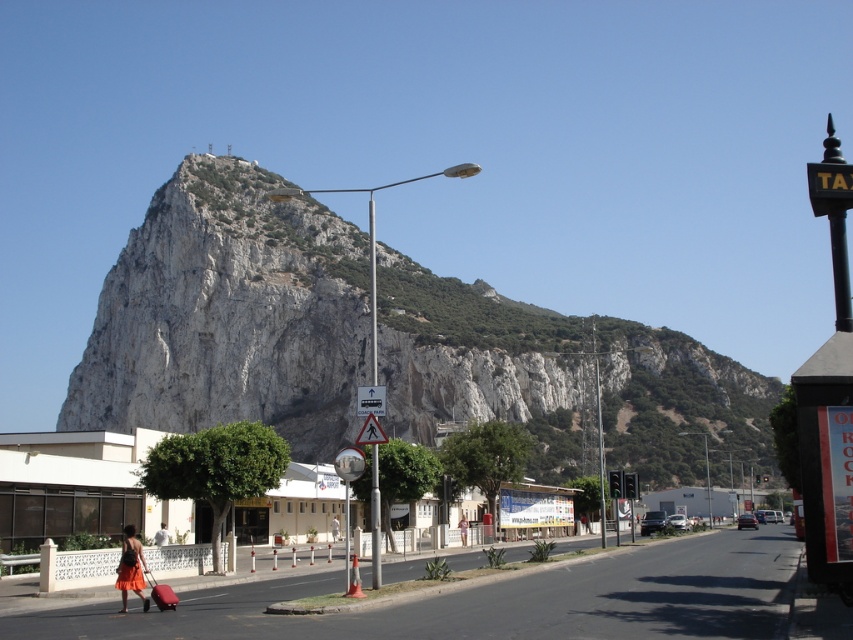
Is white rocky mountain at upper center below orange matte dress at lower left?

No.

Is white rocky mountain at upper center closer to the viewer compared to orange matte dress at lower left?

No.

Image resolution: width=853 pixels, height=640 pixels. Identify the location of white rocky mountain at upper center. (229, 316).

Can you confirm if orange fabric skirt at lower left is positioned to the right of orange matte dress at lower left?

No, orange fabric skirt at lower left is not to the right of orange matte dress at lower left.

Measure the distance between point (122,605) and camera.

They are 37.83 meters apart.

Where is `orange fabric skirt at lower left`? orange fabric skirt at lower left is located at coordinates (131, 568).

Is white rocky mountain at upper center below orange fabric skirt at lower left?

No, white rocky mountain at upper center is not below orange fabric skirt at lower left.

Image resolution: width=853 pixels, height=640 pixels. I want to click on white rocky mountain at upper center, so click(229, 316).